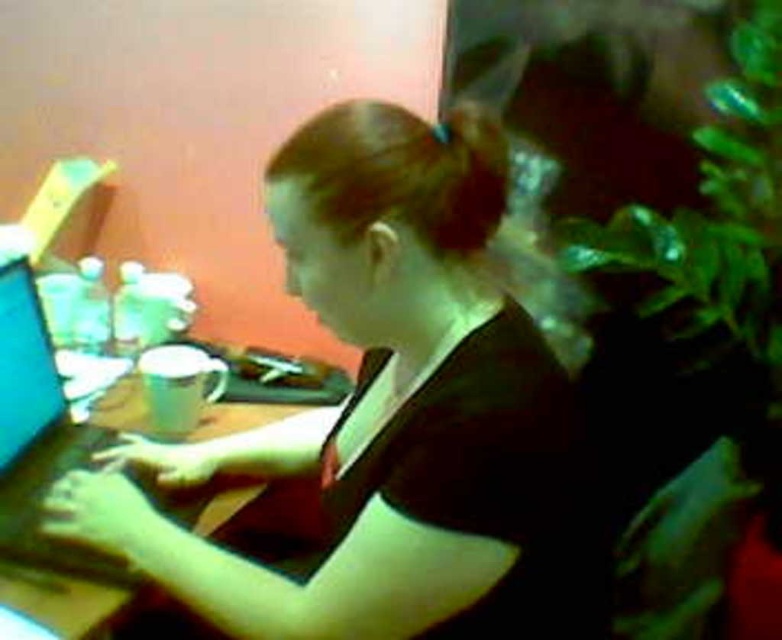
You are a tailor measuring the width of the matte black shirt at center and the wooden table at center. Which item has a greater width?

The matte black shirt at center might be wider than wooden table at center, so it is possible that the matte black shirt at center has a greater width.

You are a photographer taking a portrait of the person wearing the matte black shirt at center. The shiny blue laptop at left is currently blocking part of their face. Can you move the laptop to the side without moving the person?

The matte black shirt at center is much taller than the shiny blue laptop at left, so you can move the laptop to the side without moving the person.

You are a delivery robot that needs to place a package on the wooden table at center. The robot is 0.8 meters wide. Can the robot reach the table without moving any items on it?

The wooden table at center is 1.14 meters away from the camera. Since the robot is 0.8 meters wide, it can reach the table as the distance is sufficient for the robot to maneuver and place the package without needing to move any items on the table.